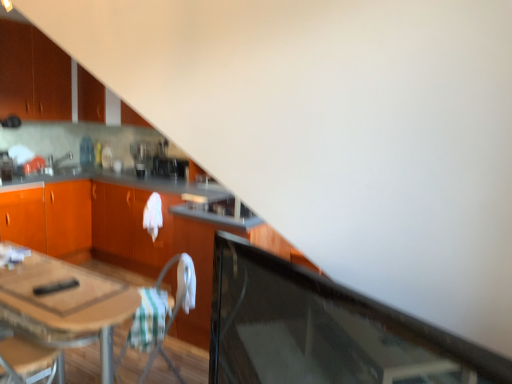
Locate an element on the screen. vacant region above wooden table at lower left (from a real-world perspective) is located at coordinates (47, 280).